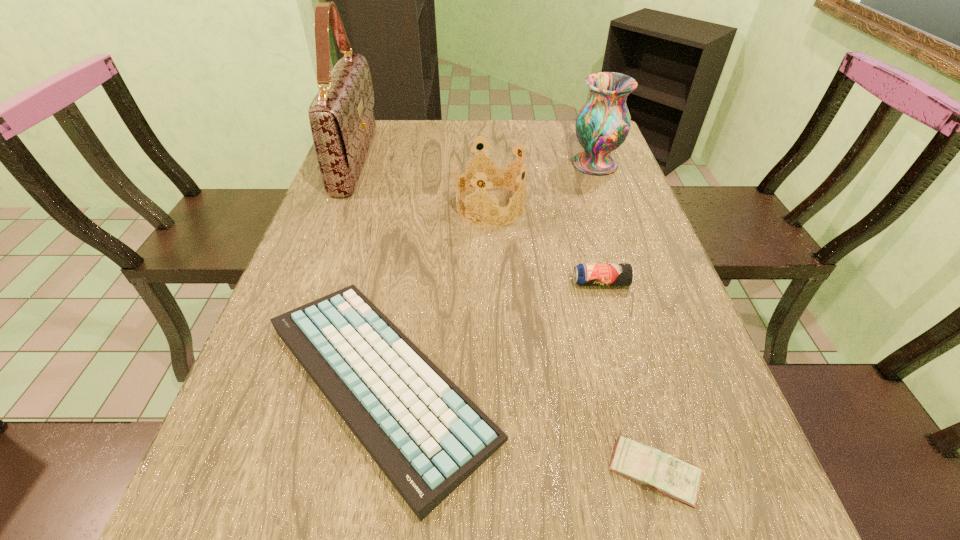
Find the location of `free space located 0.200m on the right of the computer keyboard`. free space located 0.200m on the right of the computer keyboard is located at coordinates point(615,381).

At what (x,y) coordinates should I click in order to perform the action: click on free space located on the left of the shortest object. Please return your answer as a coordinate pair (x, y). Looking at the image, I should click on (506, 472).

Locate an element on the screen. handbag that is at the far edge is located at coordinates (342, 122).

At what (x,y) coordinates should I click in order to perform the action: click on vase that is at the far edge. Please return your answer as a coordinate pair (x, y). Looking at the image, I should click on (602, 125).

Where is `handbag present at the left edge`? Image resolution: width=960 pixels, height=540 pixels. handbag present at the left edge is located at coordinates (342, 122).

The width and height of the screenshot is (960, 540). I want to click on computer keyboard located in the left edge section of the desktop, so click(x=427, y=436).

Locate an element on the screen. vase that is at the right edge is located at coordinates (602, 125).

At what (x,y) coordinates should I click in order to perform the action: click on beer can that is at the right edge. Please return your answer as a coordinate pair (x, y). Looking at the image, I should click on (584, 274).

Find the location of a particular element. The width and height of the screenshot is (960, 540). diary located at the right edge is located at coordinates (665, 473).

Locate an element on the screen. object present at the far left corner is located at coordinates (342, 122).